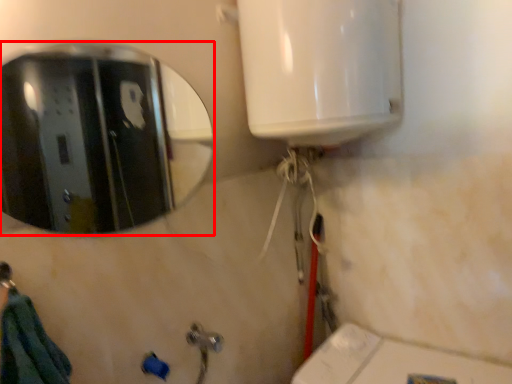
Question: From the image's perspective, what is the correct spatial positioning of mirror (annotated by the red box) in reference to shower?

Choices:
 (A) above
 (B) below

Answer: (A)